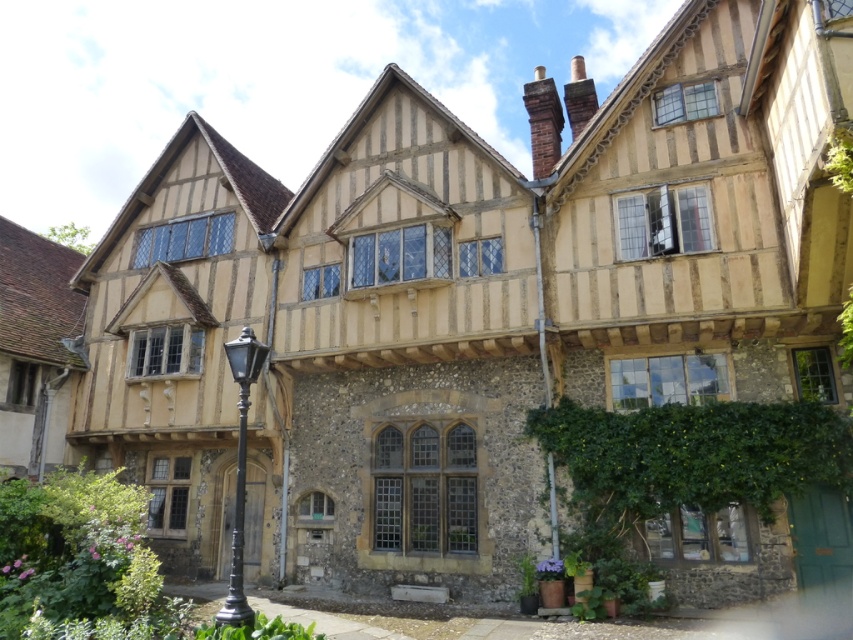
You are a visitor standing in front of the half timbered building. You notice the green leafy ivy at lower right and the black polished metal lamp post at lower left. Which object is taller?

The green leafy ivy at lower right has a lesser height compared to the black polished metal lamp post at lower left, so the black polished metal lamp post at lower left is taller.

You are standing at the entrance of the half timbered building and want to take a photo of the green leafy ivy at lower right. Where should you position yourself to capture it in the frame?

The green leafy ivy at lower right is located at coordinates point [692,456], so you should position yourself to the right side of the building and slightly towards the lower part to capture it in the frame.